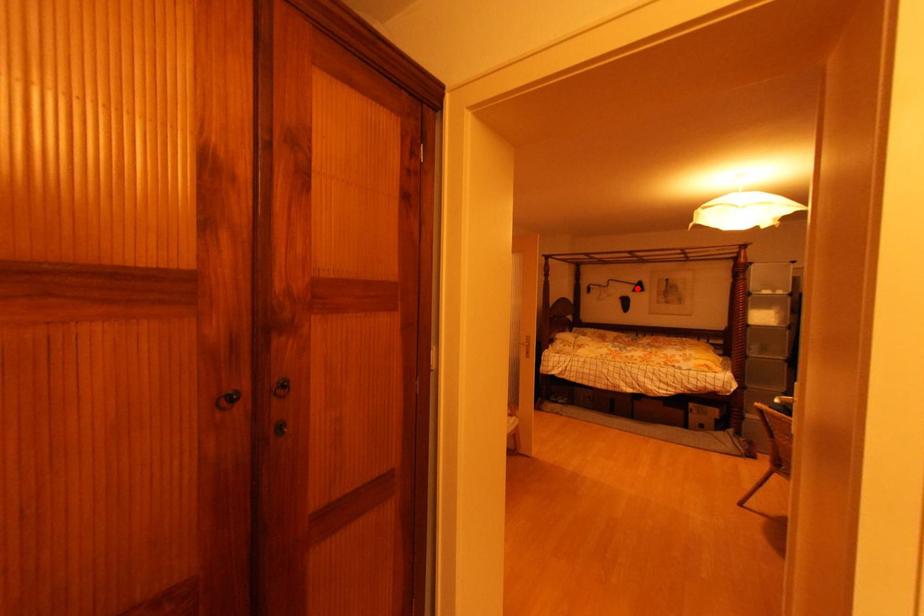
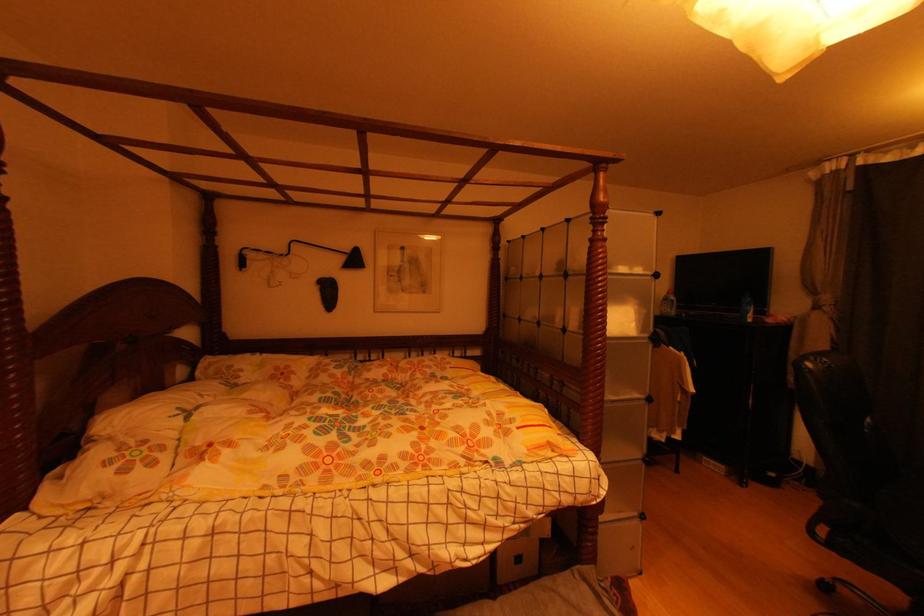
In the second image, find the point that corresponds to the highlighted location in the first image.

(346, 261)